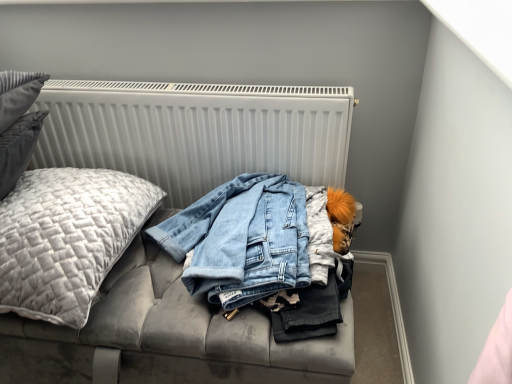
Where is `white ribbed radiator at upper center`? The width and height of the screenshot is (512, 384). white ribbed radiator at upper center is located at coordinates (196, 132).

Where is `quilted gray pillow at left`? quilted gray pillow at left is located at coordinates (67, 238).

I want to click on velvet grey couch at center, so (x=196, y=131).

From a real-world perspective, is velvet grey couch at center positioned above or below white ribbed radiator at upper center?

velvet grey couch at center is below white ribbed radiator at upper center.

Is velvet grey couch at center oriented towards white ribbed radiator at upper center?

No.

Is velvet grey couch at center outside of white ribbed radiator at upper center?

Yes.

Consider the image. Based on their sizes in the image, would you say velvet grey couch at center is bigger or smaller than white ribbed radiator at upper center?

Considering their sizes, velvet grey couch at center takes up more space than white ribbed radiator at upper center.

From a real-world perspective, between white ribbed radiator at upper center and velvet grey couch at center, who is vertically higher?

white ribbed radiator at upper center is physically above.

Does white ribbed radiator at upper center turn towards velvet grey couch at center?

Yes.

Considering the points (253, 104) and (346, 135), which point is behind, point (253, 104) or point (346, 135)?

The point (346, 135) is farther.

Which is nearer, (230, 140) or (53, 172)?

Positioned in front is point (53, 172).

From the image's perspective, which one is positioned higher, white ribbed radiator at upper center or quilted gray pillow at left?

white ribbed radiator at upper center is shown above in the image.

Identify the location of radiator that is behind the quilted gray pillow at left. (196, 132).

Does point (101, 240) appear closer or farther from the camera than point (273, 342)?

Point (101, 240) appears to be farther away from the viewer than point (273, 342).

Which is correct: quilted gray pillow at left is inside velvet grey couch at center, or outside of it?

quilted gray pillow at left is outside velvet grey couch at center.

How different are the orientations of quilted gray pillow at left and velvet grey couch at center in degrees?

0.000382 degrees.

In terms of width, does quilted gray pillow at left look wider or thinner when compared to velvet grey couch at center?

Clearly, quilted gray pillow at left has less width compared to velvet grey couch at center.

From a real-world perspective, is velvet grey couch at center beneath quilted gray pillow at left?

Yes.

What's the angular difference between velvet grey couch at center and quilted gray pillow at left's facing directions?

The angular difference between velvet grey couch at center and quilted gray pillow at left is 0.000382 degrees.

How much distance is there between velvet grey couch at center and quilted gray pillow at left?

velvet grey couch at center is 12.83 inches from quilted gray pillow at left.

Looking at their sizes, would you say velvet grey couch at center is wider or thinner than quilted gray pillow at left?

In the image, velvet grey couch at center appears to be wider than quilted gray pillow at left.

Considering the relative positions of quilted gray pillow at left and white ribbed radiator at upper center in the image provided, is quilted gray pillow at left to the left or to the right of white ribbed radiator at upper center?

Based on their positions, quilted gray pillow at left is located to the left of white ribbed radiator at upper center.

Is quilted gray pillow at left facing away from white ribbed radiator at upper center?

Yes, quilted gray pillow at left is facing away from white ribbed radiator at upper center.

From the image's perspective, is quilted gray pillow at left above or below white ribbed radiator at upper center?

Clearly, from the image's perspective, quilted gray pillow at left is below white ribbed radiator at upper center.

Does quilted gray pillow at left have a smaller size compared to white ribbed radiator at upper center?

No, quilted gray pillow at left is not smaller than white ribbed radiator at upper center.

In the image, there is a white ribbed radiator at upper center. Where is `furniture below it (from a real-world perspective)`? The height and width of the screenshot is (384, 512). furniture below it (from a real-world perspective) is located at coordinates (196, 131).

Locate an element on the screen. This screenshot has height=384, width=512. furniture below the white ribbed radiator at upper center (from the image's perspective) is located at coordinates (196, 131).

When comparing their distances from quilted gray pillow at left, does velvet grey couch at center or white ribbed radiator at upper center seem further?

velvet grey couch at center is further to quilted gray pillow at left.

Estimate the real-world distances between objects in this image. Which object is further from white ribbed radiator at upper center, velvet grey couch at center or quilted gray pillow at left?

quilted gray pillow at left lies further to white ribbed radiator at upper center than the other object.

From the image, which object appears to be nearer to quilted gray pillow at left, white ribbed radiator at upper center or velvet grey couch at center?

The object closer to quilted gray pillow at left is white ribbed radiator at upper center.

Considering their positions, is quilted gray pillow at left positioned further to velvet grey couch at center than white ribbed radiator at upper center?

The object further to velvet grey couch at center is quilted gray pillow at left.

Based on their spatial positions, is quilted gray pillow at left or velvet grey couch at center further from white ribbed radiator at upper center?

quilted gray pillow at left lies further to white ribbed radiator at upper center than the other object.

Looking at the image, which one is located further to velvet grey couch at center, white ribbed radiator at upper center or quilted gray pillow at left?

Among the two, quilted gray pillow at left is located further to velvet grey couch at center.

Where is `furniture located between quilted gray pillow at left and white ribbed radiator at upper center in the left-right direction`? This screenshot has height=384, width=512. furniture located between quilted gray pillow at left and white ribbed radiator at upper center in the left-right direction is located at coordinates pos(196,131).